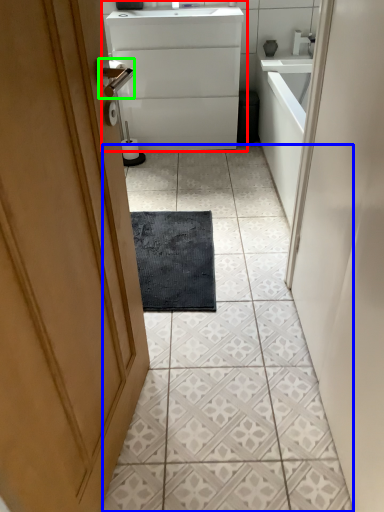
Question: Which is nearer to the bathroom cabinet (highlighted by a red box)? ceramic tile (highlighted by a blue box) or door handle (highlighted by a green box).

Choices:
 (A) ceramic tile
 (B) door handle

Answer: (A)